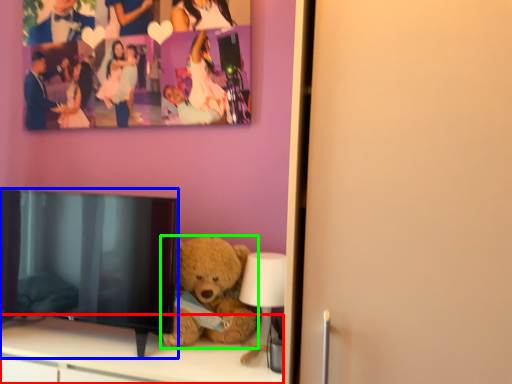
Question: Which object is positioned farthest from furniture (highlighted by a red box)? Select from television (highlighted by a blue box) and teddy bear (highlighted by a green box).

Choices:
 (A) television
 (B) teddy bear

Answer: (B)